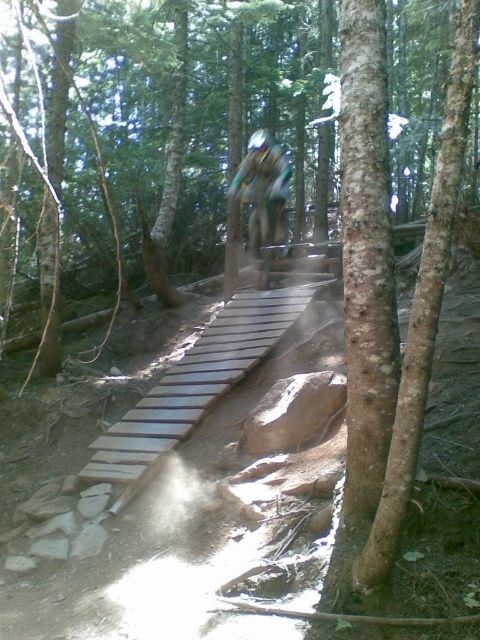
You are a mountain biker navigating a narrow wooden trail in a forest. You see two points marked on your map at coordinates point [129,493] and point [288,173]. Which point should you approach first if you want to follow the trail in the direction it is heading?

You should approach point [129,493] first because it is in front of point [288,173] along the trail direction.

You are a mountain biker preparing to descend a trail. You see a light brown wooden ramp at center and a camouflage fabric jacket at center. Which object is positioned to the left from your perspective?

The light brown wooden ramp at center is to the left of the camouflage fabric jacket at center, so the ramp is positioned to the left.